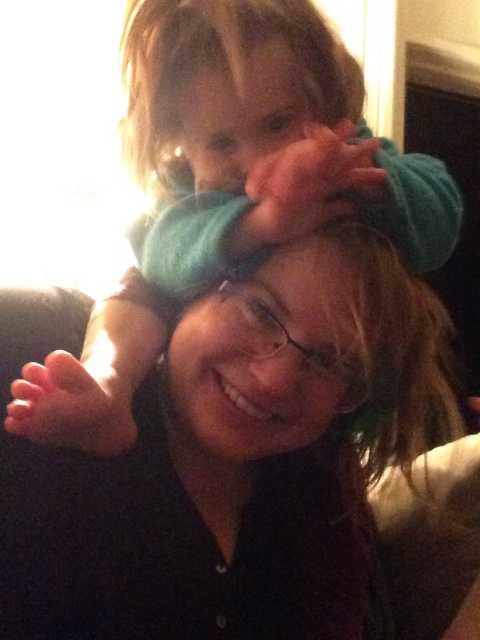
Does matte blue beanie at upper center have a greater height compared to black fabric shoulder at upper right?

Indeed, matte blue beanie at upper center has a greater height compared to black fabric shoulder at upper right.

Is point (173, 484) in front of point (433, 529)?

Yes, point (173, 484) is in front of point (433, 529).

At what (x,y) coordinates should I click in order to perform the action: click on matte blue beanie at upper center. Please return your answer as a coordinate pair (x, y). Image resolution: width=480 pixels, height=640 pixels. Looking at the image, I should click on (261, 472).

Which is behind, point (153, 241) or point (305, 442)?

The point (153, 241) is behind.

How much distance is there between soft teal blanket at upper center and matte blue beanie at center?

soft teal blanket at upper center and matte blue beanie at center are 10.86 centimeters apart from each other.

Find the location of a particular element. The image size is (480, 640). soft teal blanket at upper center is located at coordinates (228, 186).

Which is above, blurred teal hat at upper center or black fabric shoulder at upper right?

Positioned higher is blurred teal hat at upper center.

Find the location of `blurred teal hat at upper center`. blurred teal hat at upper center is located at coordinates (222, 65).

Identify the location of blurred teal hat at upper center. Image resolution: width=480 pixels, height=640 pixels. (222, 65).